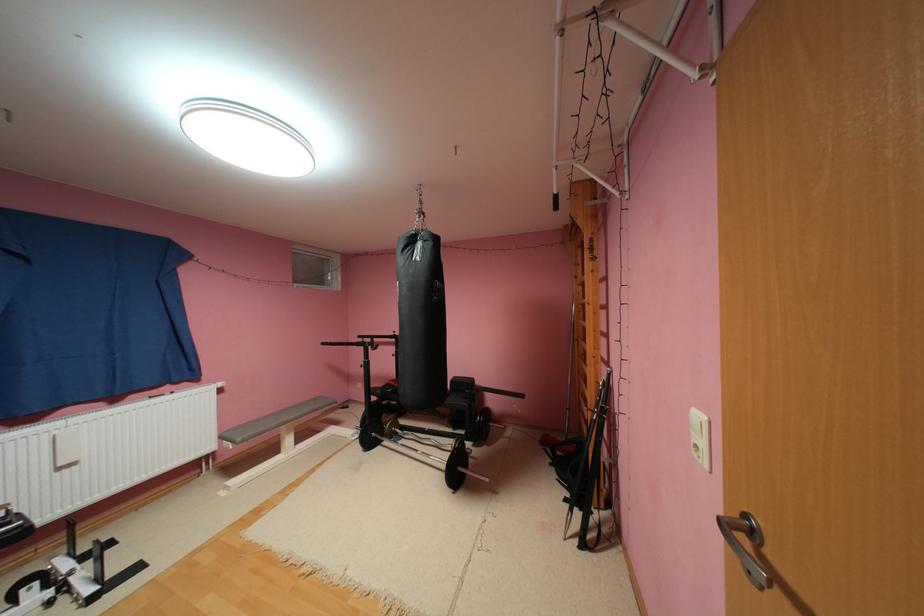
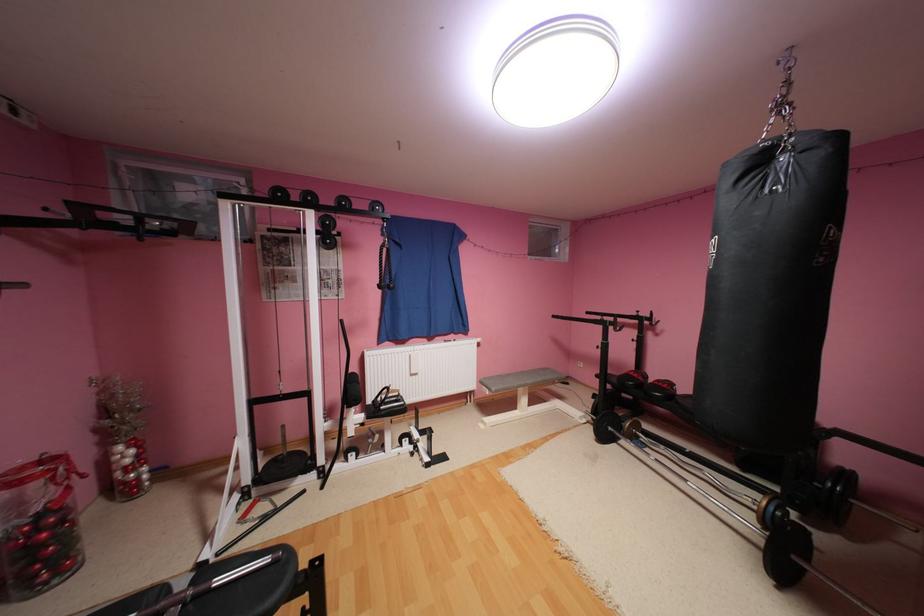
Question: The first image is from the beginning of the video and the second image is from the end. How did the camera likely rotate when shooting the video?

Choices:
 (A) Left
 (B) Right
 (C) Up
 (D) Down

Answer: (A)